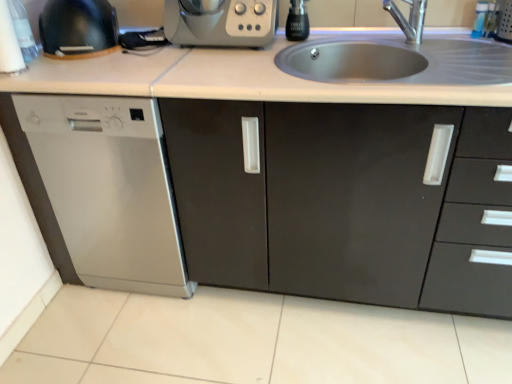
Question: Could you tell me if matte black cabinet at center is facing silver metallic faucet at upper center?

Choices:
 (A) yes
 (B) no

Answer: (B)

Question: Does matte black cabinet at center have a greater width compared to silver metallic faucet at upper center?

Choices:
 (A) no
 (B) yes

Answer: (B)

Question: Is matte black cabinet at center positioned in front of silver metallic faucet at upper center?

Choices:
 (A) yes
 (B) no

Answer: (A)

Question: Is matte black cabinet at center thinner than silver metallic faucet at upper center?

Choices:
 (A) yes
 (B) no

Answer: (B)

Question: From the image's perspective, is matte black cabinet at center over silver metallic faucet at upper center?

Choices:
 (A) yes
 (B) no

Answer: (B)

Question: From the image's perspective, is matte black cabinet at center below silver metallic faucet at upper center?

Choices:
 (A) no
 (B) yes

Answer: (B)

Question: From the image's perspective, is matte black kettle at upper left, the second appliance when ordered from right to left, located beneath satin silver appliance at upper center?

Choices:
 (A) yes
 (B) no

Answer: (B)

Question: Is matte black kettle at upper left, the second appliance when ordered from right to left, located outside satin silver appliance at upper center?

Choices:
 (A) no
 (B) yes

Answer: (B)

Question: From a real-world perspective, is matte black kettle at upper left, which is the 1th appliance in left-to-right order, located higher than satin silver appliance at upper center?

Choices:
 (A) no
 (B) yes

Answer: (B)

Question: Is matte black kettle at upper left, the second appliance when ordered from right to left, with satin silver appliance at upper center?

Choices:
 (A) yes
 (B) no

Answer: (B)

Question: Is matte black kettle at upper left, the second appliance when ordered from right to left, oriented away from satin silver appliance at upper center?

Choices:
 (A) no
 (B) yes

Answer: (A)

Question: Considering the relative positions of matte black kettle at upper left, which is the 1th appliance in left-to-right order, and satin silver appliance at upper center in the image provided, is matte black kettle at upper left, which is the 1th appliance in left-to-right order, to the left of satin silver appliance at upper center from the viewer's perspective?

Choices:
 (A) yes
 (B) no

Answer: (A)

Question: Would you say matte black kettle at upper left, the second appliance when ordered from right to left, is part of stainless steel sink at upper center's contents?

Choices:
 (A) yes
 (B) no

Answer: (B)